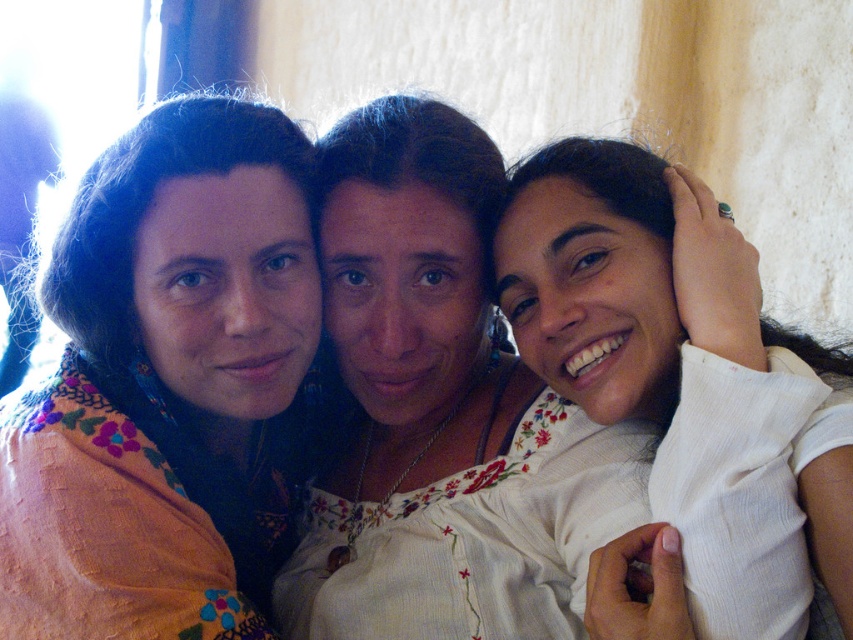
Consider the image. You are a photographer adjusting the lighting for a group photo. You notice the embroidered fabric at center and the white embroidered blouse at center. Which object should you adjust the light towards to ensure both are equally illuminated if the current lighting is coming from the right side?

The embroidered fabric at center is to the left of the white embroidered blouse at center. Since the light is coming from the right, the embroidered fabric at center might be in shadow. To ensure equal illumination, adjust the light towards the embroidered fabric at center.